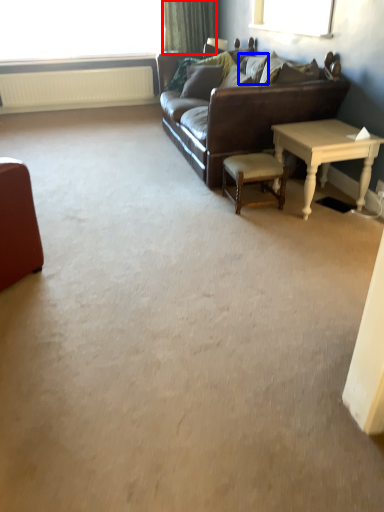
Question: Which object appears closest to the camera in this image, curtain (highlighted by a red box) or pillow (highlighted by a blue box)?

Choices:
 (A) curtain
 (B) pillow

Answer: (B)